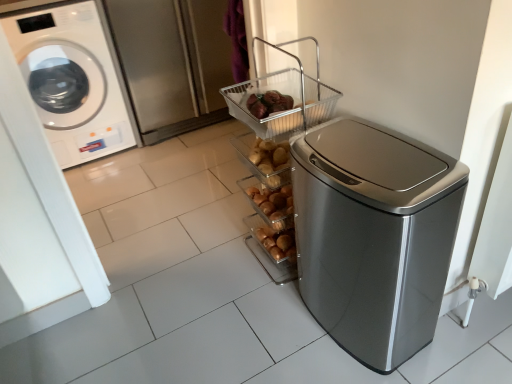
Question: Looking at their shapes, would you say brushed metal screen door at upper left is wider or thinner than metallic wire basket at upper center?

Choices:
 (A) wide
 (B) thin

Answer: (A)

Question: Looking at the image, does brushed metal screen door at upper left seem bigger or smaller compared to metallic wire basket at upper center?

Choices:
 (A) big
 (B) small

Answer: (A)

Question: Based on their relative distances, which object is farther from the white glossy washing machine at left?

Choices:
 (A) satin silver trash can at right
 (B) metallic wire basket at upper center
 (C) brushed metal screen door at upper left

Answer: (A)

Question: Which is farther from the satin silver trash can at right?

Choices:
 (A) white glossy washing machine at left
 (B) metallic wire basket at upper center
 (C) brushed metal screen door at upper left

Answer: (A)